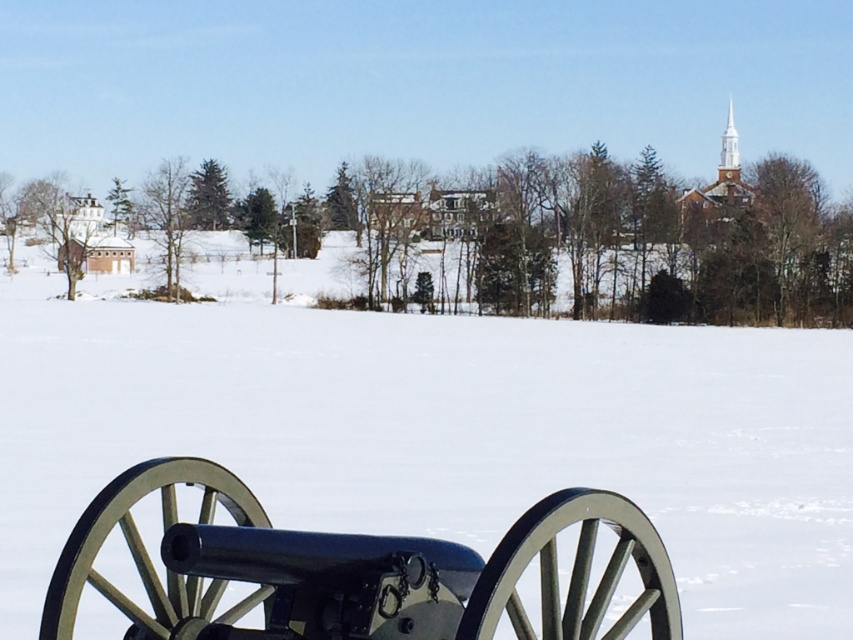
Question: Which point appears closest to the camera in this image?

Choices:
 (A) (590, 540)
 (B) (724, 164)

Answer: (A)

Question: Which of the following is the closest to the observer?

Choices:
 (A) (236, 561)
 (B) (721, 163)

Answer: (A)

Question: Is the position of polished steel cannon at lower left less distant than that of white wooden steeple at upper right?

Choices:
 (A) no
 (B) yes

Answer: (B)

Question: Is polished steel cannon at lower left to the right of white wooden steeple at upper right from the viewer's perspective?

Choices:
 (A) no
 (B) yes

Answer: (A)

Question: From the image, what is the correct spatial relationship of polished steel cannon at lower left in relation to white wooden steeple at upper right?

Choices:
 (A) left
 (B) right

Answer: (A)